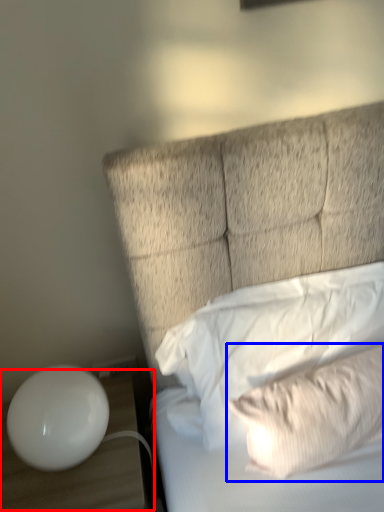
Question: Which of the following is the closest to the observer, table (highlighted by a red box) or pillow (highlighted by a blue box)?

Choices:
 (A) table
 (B) pillow

Answer: (B)